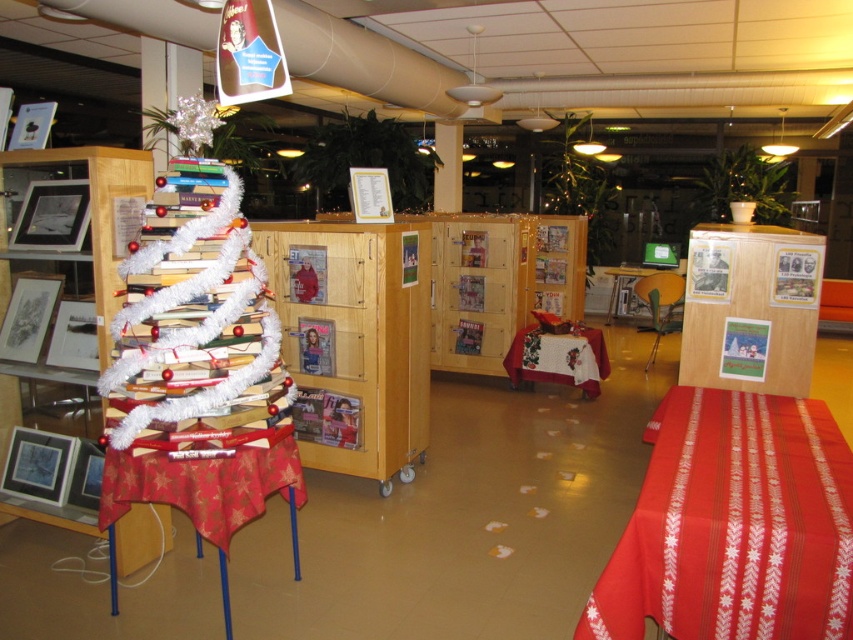
You are standing in front of the festive book display and want to take a photo. You notice two points marked in the image. Which point, point (x=718, y=413) or point (x=187, y=220), is closer to your camera lens?

Point (x=187, y=220) is closer to the camera lens because it is less further away than point (x=718, y=413).

You are setting up a new decoration in the library and need to place a 3.5 feet wide banner between the red fabric tablecloth at lower right and the white tinsel book at left. Will there be enough space for the banner?

The distance between the red fabric tablecloth at lower right and the white tinsel book at left is 5.20 feet. Since the banner is 3.5 feet wide, there is sufficient space as 5.20 feet is greater than 3.5 feet.